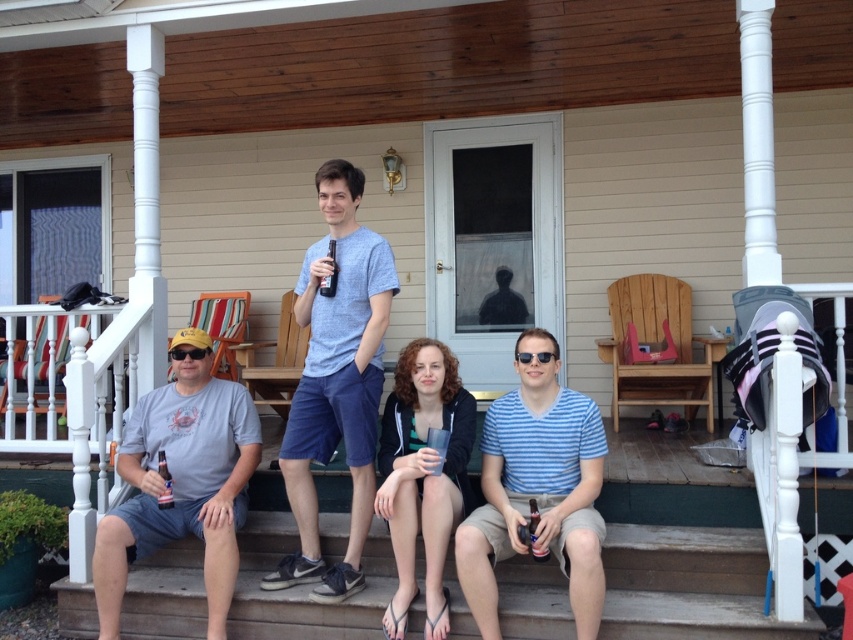
You are a photographer standing at the lower left corner of the porch. You want to take a photo of the metallic silver can at lower center. Which direction should you move to get the best shot?

The metallic silver can at lower center is located at point 0.833 on the x axis and 0.627 on the y axis. Since you are at the lower left corner, you should move towards the right and slightly upwards to align with the can for the best shot.